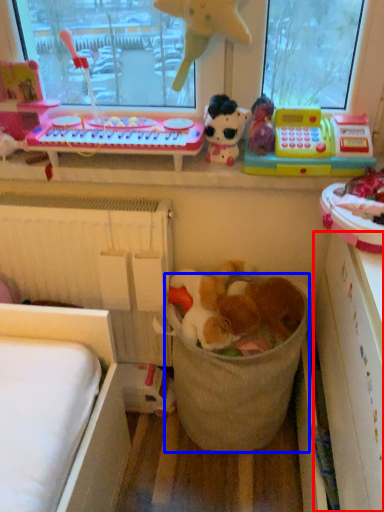
Question: Which point is closer to the camera, shelf (highlighted by a red box) or laundry basket (highlighted by a blue box)?

Choices:
 (A) shelf
 (B) laundry basket

Answer: (A)